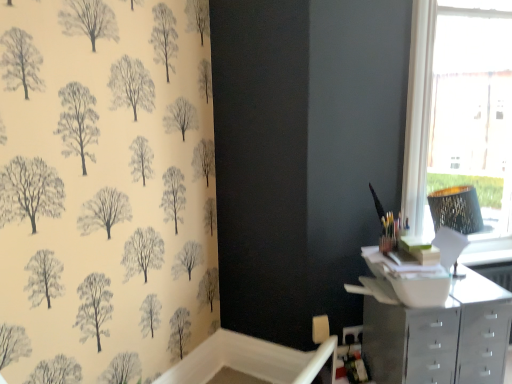
Question: From a real-world perspective, is white frame at upper right physically located above or below white glossy file cabinet at lower right?

Choices:
 (A) below
 (B) above

Answer: (B)

Question: In terms of width, does white frame at upper right look wider or thinner when compared to white glossy file cabinet at lower right?

Choices:
 (A) thin
 (B) wide

Answer: (A)

Question: Which object is the closest to the white glossy file cabinet at lower right?

Choices:
 (A) metallic silver chest of drawers at lower right
 (B) metallic mosaic lampshade at right
 (C) white frame at upper right

Answer: (A)

Question: Estimate the real-world distances between objects in this image. Which object is farther from the metallic silver chest of drawers at lower right?

Choices:
 (A) white frame at upper right
 (B) metallic mosaic lampshade at right
 (C) white glossy file cabinet at lower right

Answer: (A)